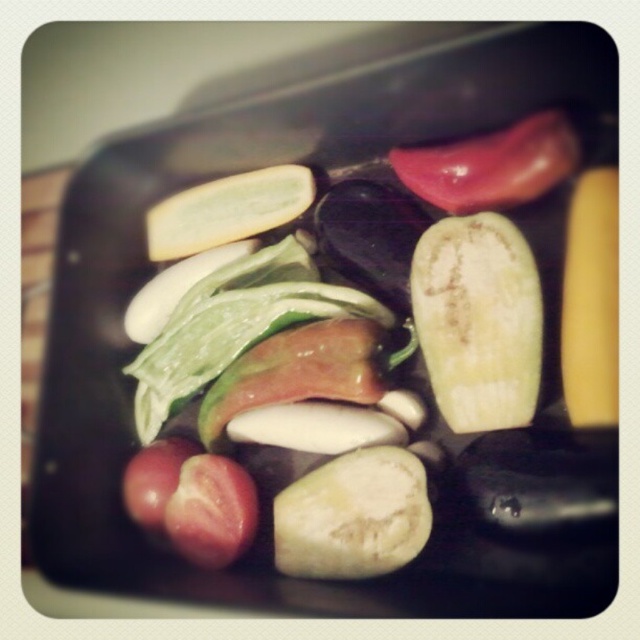
You are a food stylist arranging vegetables on a dark tray. You have two points marked on the tray where you need to place a zucchini slice and a bell pepper slice. The coordinates for the first point are point (x=444, y=298) and the second point are point (x=388, y=156). According to the image, which point should you place the zucchini slice to ensure it appears closer to the viewer?

Point (x=444, y=298) is in front of point (x=388, y=156), so you should place the zucchini slice at point (x=444, y=298) to make it appear closer to the viewer.

You are a food stylist standing 3 feet away from a dark tray holding the green matte apple at center. Can you safely pick up the apple without moving your feet?

The green matte apple at center is 3.29 feet away from you. Since you are standing 3 feet away, you can safely reach it without moving your feet because the distance is within your comfortable reach.